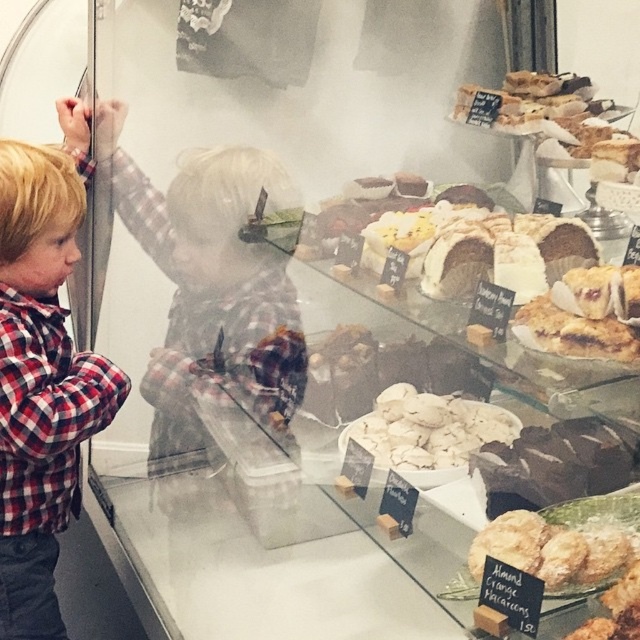
Does point (419, 445) come behind point (586, 280)?

Yes, it is behind point (586, 280).

Does point (449, 435) lie behind point (618, 358)?

Yes, it is.

Where is `white fluffy pastries at center`? white fluffy pastries at center is located at coordinates (428, 429).

Who is positioned more to the left, white fluffy pastries at center or almond croissant at lower right?

white fluffy pastries at center is more to the left.

Is point (385, 444) positioned before point (561, 582)?

No, (385, 444) is behind (561, 582).

Which is behind, point (394, 404) or point (582, 564)?

Positioned behind is point (394, 404).

Find the location of `white fluffy pastries at center`. white fluffy pastries at center is located at coordinates (428, 429).

Is the position of golden flaky pie at center more distant than that of almond croissant at lower right?

No.

In the scene shown: Who is positioned more to the left, golden flaky pie at center or almond croissant at lower right?

almond croissant at lower right

Between point (586, 289) and point (540, 540), which one is positioned in front?

Point (586, 289)

Identify the location of golden flaky pie at center. (588, 314).